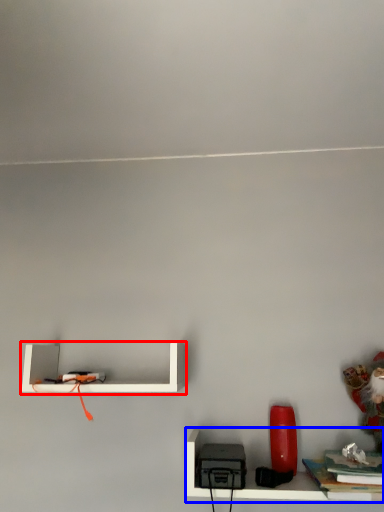
Question: Which object appears farthest to the camera in this image, shelf (highlighted by a red box) or shelf (highlighted by a blue box)?

Choices:
 (A) shelf
 (B) shelf

Answer: (A)